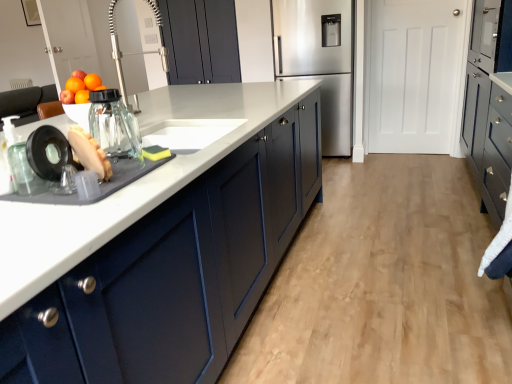
You are a GUI agent. You are given a task and a screenshot of the screen. Output one action in this format:
    pyautogui.click(x=<x>, y=<y>)
    Task: Click on the free spot in front of brown matte bread at left, placed as the 1th food when sorted from left to right
    The image size is (512, 384).
    Given the screenshot: What is the action you would take?
    pyautogui.click(x=75, y=206)